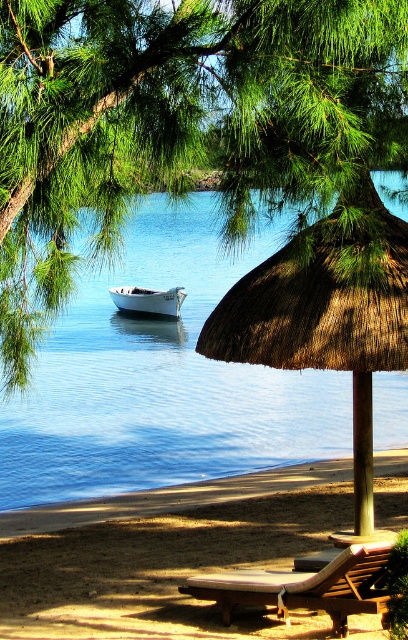
Who is more forward, (x=328, y=284) or (x=172, y=296)?

Point (x=328, y=284) is in front.

Between brown/thatched umbrella at center and white matte boat at center, which one has more height?

With more height is brown/thatched umbrella at center.

You are a GUI agent. You are given a task and a screenshot of the screen. Output one action in this format:
    pyautogui.click(x=<x>, y=<y>)
    Task: Click on the brown/thatched umbrella at center
    The image size is (408, 640).
    Given the screenshot: What is the action you would take?
    pyautogui.click(x=326, y=314)

Is blue water at center shorter than brown sandy beach at lower center?

No.

The image size is (408, 640). In order to click on blue water at center in this screenshot , I will do `click(161, 380)`.

This screenshot has width=408, height=640. In order to click on blue water at center in this screenshot , I will do `click(161, 380)`.

Does brown sandy beach at lower center have a smaller size compared to brown/thatched umbrella at center?

Yes.

Is brown sandy beach at lower center wider than brown/thatched umbrella at center?

In fact, brown sandy beach at lower center might be narrower than brown/thatched umbrella at center.

Identify the location of brown sandy beach at lower center. (166, 556).